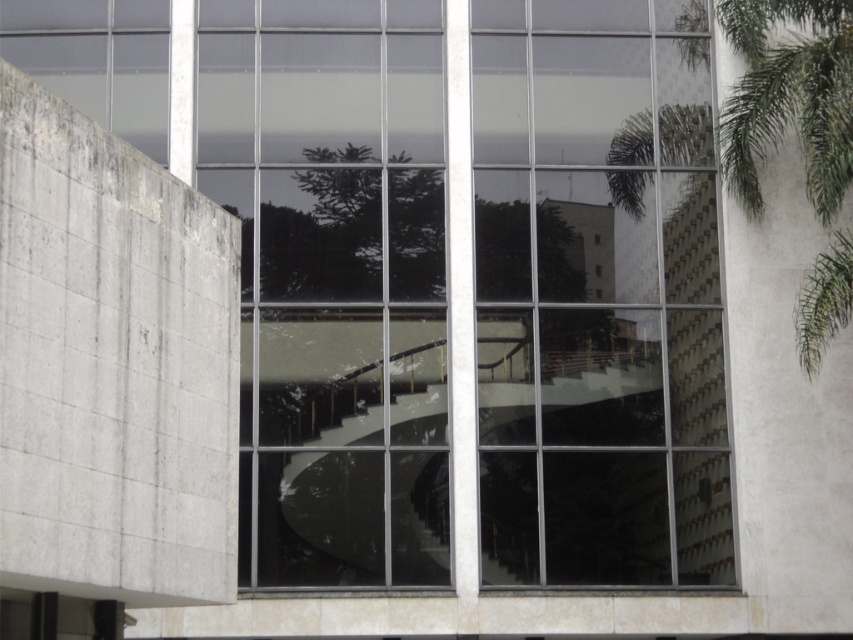
Is the position of green leafy palm tree at right more distant than that of green leafy tree at center?

No, green leafy palm tree at right is closer to the viewer.

Which is behind, point (828, 70) or point (357, 220)?

The point (357, 220) is behind.

Is point (755, 84) positioned before point (399, 300)?

Yes.

Locate an element on the screen. The image size is (853, 640). green leafy palm tree at right is located at coordinates (788, 97).

Is transparent glass window at center in front of green leafy tree at center?

Yes, it is in front of green leafy tree at center.

Is transparent glass window at center positioned at the back of green leafy tree at center?

No, it is not.

Locate an element on the screen. The height and width of the screenshot is (640, 853). transparent glass window at center is located at coordinates (473, 289).

Does transparent glass window at center have a larger size compared to green leafy palm tree at right?

Yes, transparent glass window at center is bigger than green leafy palm tree at right.

Can you confirm if transparent glass window at center is positioned to the left of green leafy palm tree at right?

Indeed, transparent glass window at center is positioned on the left side of green leafy palm tree at right.

You are a GUI agent. You are given a task and a screenshot of the screen. Output one action in this format:
    pyautogui.click(x=<x>, y=<y>)
    Task: Click on the transparent glass window at center
    The image size is (853, 640).
    Given the screenshot: What is the action you would take?
    pyautogui.click(x=473, y=289)

This screenshot has height=640, width=853. Identify the location of transparent glass window at center. (473, 289).